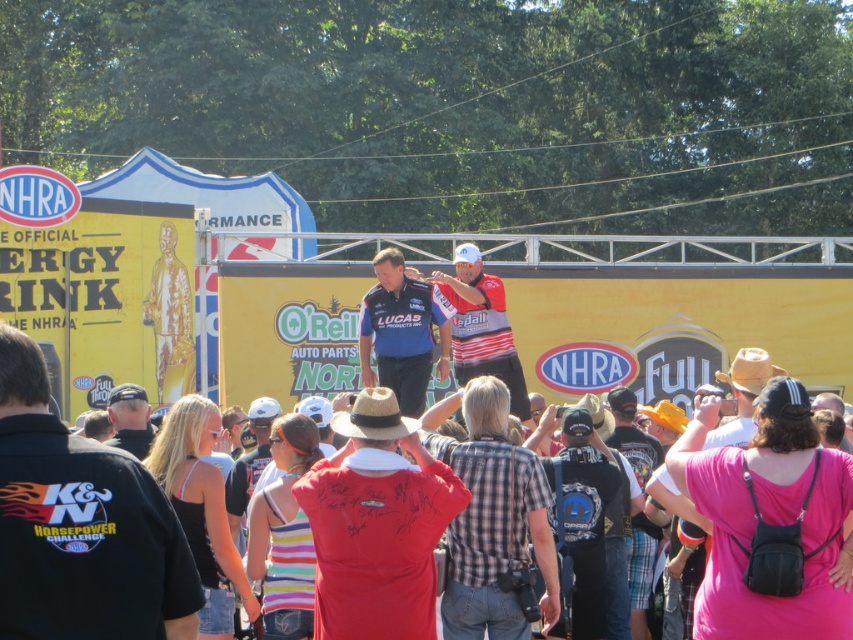
Which is more to the left, black cotton shirt at center or striped jersey at center?

black cotton shirt at center is more to the left.

Who is positioned more to the right, black cotton shirt at center or striped jersey at center?

striped jersey at center

What are the coordinates of `black cotton shirt at center` in the screenshot? It's located at (80, 525).

At what (x,y) coordinates should I click in order to perform the action: click on black cotton shirt at center. Please return your answer as a coordinate pair (x, y). This screenshot has width=853, height=640. Looking at the image, I should click on (80, 525).

Between point (99, 609) and point (144, 396), which one is positioned in front?

Point (99, 609) is more forward.

Between black cotton shirt at center and black cap at center, which one appears on the right side from the viewer's perspective?

From the viewer's perspective, black cotton shirt at center appears more on the right side.

Find the location of `black cotton shirt at center`. black cotton shirt at center is located at coordinates click(80, 525).

I want to click on black cotton shirt at center, so click(80, 525).

The height and width of the screenshot is (640, 853). Describe the element at coordinates (399, 332) in the screenshot. I see `blue jersey at center` at that location.

Between point (375, 355) and point (366, 404), which one is positioned in front?

Point (366, 404) is more forward.

This screenshot has height=640, width=853. I want to click on blue jersey at center, so click(399, 332).

What are the coordinates of `blue jersey at center` in the screenshot? It's located at click(399, 332).